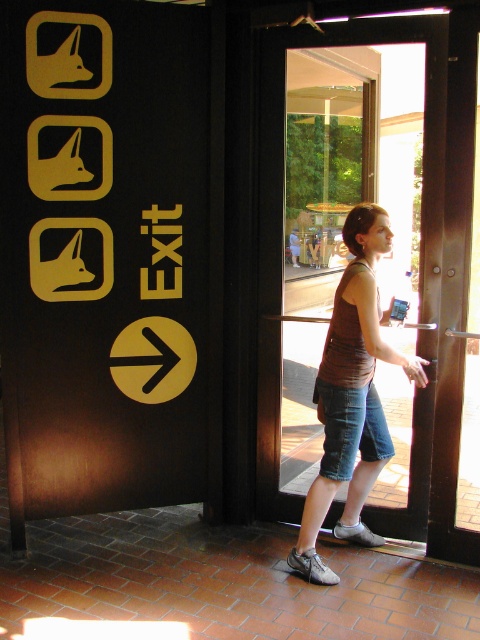
Between point (73, 230) and point (427, 145), which one is positioned behind?

The point (73, 230) is behind.

Between matte black sign at exit right and transparent glass door at center, which one has less height?

transparent glass door at center

This screenshot has width=480, height=640. I want to click on matte black sign at exit right, so click(105, 250).

Does transparent glass door at center have a greater height compared to brown fabric tank top at center?

Correct, transparent glass door at center is much taller as brown fabric tank top at center.

Is point (269, 461) positioned in front of point (322, 355)?

Yes.

Find the location of `transparent glass door at center`. transparent glass door at center is located at coordinates (336, 208).

Identify the location of transparent glass door at center. (336, 208).

From the picture: Does matte black sign at exit right have a smaller size compared to brown fabric tank top at center?

No, matte black sign at exit right is not smaller than brown fabric tank top at center.

Which is below, matte black sign at exit right or brown fabric tank top at center?

Positioned lower is brown fabric tank top at center.

Between point (41, 202) and point (370, 305), which one is positioned behind?

The point (41, 202) is more distant.

Identify the location of matte black sign at exit right. (105, 250).